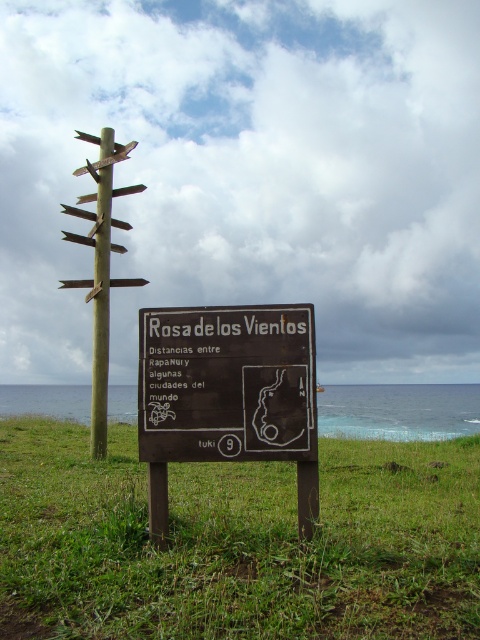
Which is behind, point (244, 342) or point (106, 144)?

Positioned behind is point (106, 144).

Between point (141, 442) and point (97, 180), which one is positioned in front?

Positioned in front is point (141, 442).

Between point (265, 314) and point (97, 332), which one is positioned in front?

Point (265, 314) is more forward.

At what (x,y) coordinates should I click in order to perform the action: click on brown wooden sign at center. Please return your answer as a coordinate pair (x, y). This screenshot has width=480, height=640. Looking at the image, I should click on (228, 396).

Does green grass at center have a larger size compared to wooden signpost at center?

Yes, green grass at center is bigger than wooden signpost at center.

Can you confirm if green grass at center is wider than wooden signpost at center?

Yes, green grass at center is wider than wooden signpost at center.

Is point (423, 536) farther from viewer compared to point (107, 298)?

No, (423, 536) is closer to viewer.

Find the location of a particular element. green grass at center is located at coordinates (237, 541).

Locate an element on the screen. The width and height of the screenshot is (480, 640). wooden signpost at left is located at coordinates (100, 268).

Does point (112, 196) come closer to viewer compared to point (103, 291)?

That is False.

Is point (108, 128) farther from viewer compared to point (101, 280)?

Yes.

The height and width of the screenshot is (640, 480). In order to click on wooden signpost at left in this screenshot , I will do coord(100,268).